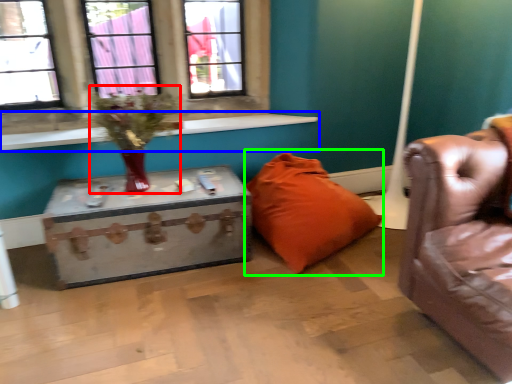
Question: Which object is the closest to the floral arrangement (highlighted by a red box)? Choose among these: window sill (highlighted by a blue box) or pillow (highlighted by a green box).

Choices:
 (A) window sill
 (B) pillow

Answer: (A)